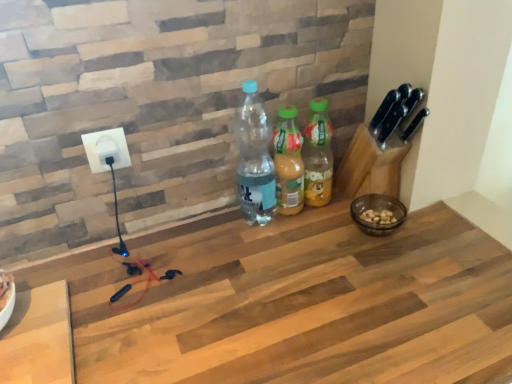
Find the location of a particular element. vacant space in front of transparent plastic bottle at center, the third bottle from the right is located at coordinates (266, 267).